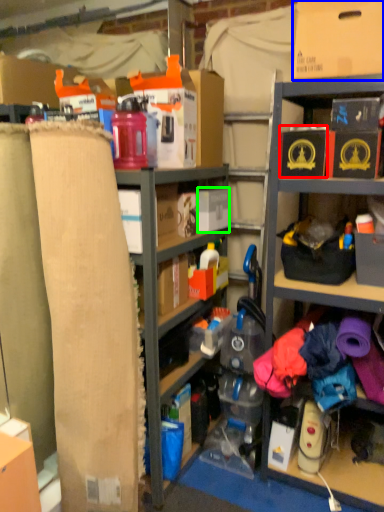
Question: Which is nearer to the storage box (highlighted by a red box)? cardboard box (highlighted by a blue box) or storage box (highlighted by a green box).

Choices:
 (A) cardboard box
 (B) storage box

Answer: (A)